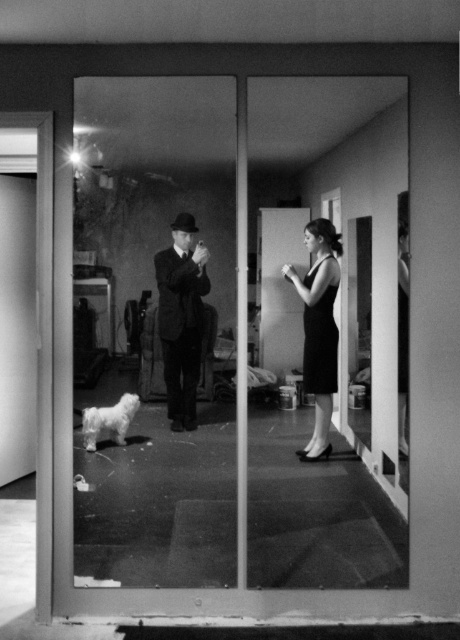
Question: Does transparent glass door at center come in front of smooth black suit at center?

Choices:
 (A) no
 (B) yes

Answer: (B)

Question: Is transparent glass door at center smaller than black satin dress at center?

Choices:
 (A) no
 (B) yes

Answer: (A)

Question: Which point is closer to the camera?

Choices:
 (A) transparent glass door at center
 (B) black satin dress at center
 (C) white fluffy dog at lower left
 (D) smooth black suit at center

Answer: (A)

Question: Among these objects, which one is farthest from the camera?

Choices:
 (A) white fluffy dog at lower left
 (B) smooth black suit at center

Answer: (A)

Question: Does smooth black suit at center have a larger size compared to white fluffy dog at lower left?

Choices:
 (A) yes
 (B) no

Answer: (A)

Question: Which point is closer to the camera?

Choices:
 (A) smooth black suit at center
 (B) black satin dress at center

Answer: (A)